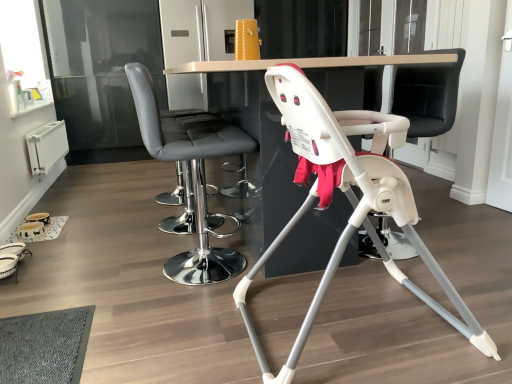
Question: Does matte gray bar stool at center, marked as the second chair in a right-to-left arrangement, have a lesser height compared to white plastic swivel chair at center?

Choices:
 (A) no
 (B) yes

Answer: (B)

Question: Is matte gray bar stool at center, which ranks as the first chair in left-to-right order, not close to white plastic swivel chair at center?

Choices:
 (A) yes
 (B) no

Answer: (B)

Question: Is matte gray bar stool at center, which ranks as the first chair in left-to-right order, outside white plastic swivel chair at center?

Choices:
 (A) yes
 (B) no

Answer: (A)

Question: Can you confirm if matte gray bar stool at center, marked as the second chair in a right-to-left arrangement, is bigger than white plastic swivel chair at center?

Choices:
 (A) yes
 (B) no

Answer: (B)

Question: Can you confirm if matte gray bar stool at center, marked as the second chair in a right-to-left arrangement, is wider than white plastic swivel chair at center?

Choices:
 (A) yes
 (B) no

Answer: (A)

Question: Is matte gray bar stool at center, marked as the second chair in a right-to-left arrangement, oriented away from white plastic swivel chair at center?

Choices:
 (A) no
 (B) yes

Answer: (A)

Question: Considering the relative positions of matte gray bar stool at center, which ranks as the first chair in left-to-right order, and white glossy table at center in the image provided, is matte gray bar stool at center, which ranks as the first chair in left-to-right order, behind white glossy table at center?

Choices:
 (A) yes
 (B) no

Answer: (A)

Question: Is matte gray bar stool at center, which ranks as the first chair in left-to-right order, looking in the opposite direction of white glossy table at center?

Choices:
 (A) no
 (B) yes

Answer: (B)

Question: Can you confirm if matte gray bar stool at center, which ranks as the first chair in left-to-right order, is thinner than white glossy table at center?

Choices:
 (A) yes
 (B) no

Answer: (A)

Question: From the image's perspective, is matte gray bar stool at center, which ranks as the first chair in left-to-right order, beneath white glossy table at center?

Choices:
 (A) no
 (B) yes

Answer: (B)

Question: Could you tell me if matte gray bar stool at center, which ranks as the first chair in left-to-right order, is turned towards white glossy table at center?

Choices:
 (A) no
 (B) yes

Answer: (B)

Question: Can you confirm if matte gray bar stool at center, marked as the second chair in a right-to-left arrangement, is wider than white glossy table at center?

Choices:
 (A) no
 (B) yes

Answer: (A)

Question: Is white plastic swivel chair at center positioned far away from matte gray bar stool at center, which ranks as the first chair in left-to-right order?

Choices:
 (A) yes
 (B) no

Answer: (B)